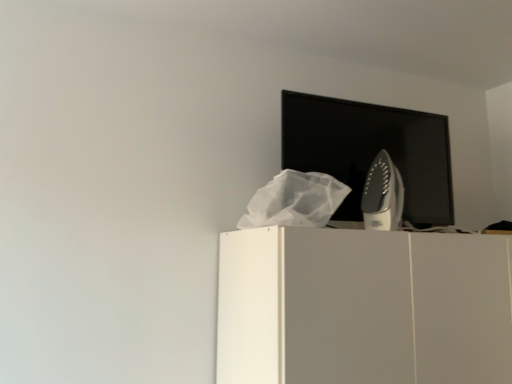
Question: From the image's perspective, is black glossy computer monitor at upper center over white matte cabinet at upper center?

Choices:
 (A) no
 (B) yes

Answer: (B)

Question: Does black glossy computer monitor at upper center have a smaller size compared to white matte cabinet at upper center?

Choices:
 (A) no
 (B) yes

Answer: (B)

Question: From a real-world perspective, is black glossy computer monitor at upper center on top of white matte cabinet at upper center?

Choices:
 (A) no
 (B) yes

Answer: (B)

Question: From the image's perspective, is black glossy computer monitor at upper center below white matte cabinet at upper center?

Choices:
 (A) no
 (B) yes

Answer: (A)

Question: Is black glossy computer monitor at upper center shorter than white matte cabinet at upper center?

Choices:
 (A) yes
 (B) no

Answer: (A)

Question: Is black glossy computer monitor at upper center located outside white matte cabinet at upper center?

Choices:
 (A) yes
 (B) no

Answer: (A)

Question: Is satin silver iron at upper right completely or partially inside white matte cabinet at upper center?

Choices:
 (A) yes
 (B) no

Answer: (B)

Question: Does white matte cabinet at upper center have a smaller size compared to satin silver iron at upper right?

Choices:
 (A) yes
 (B) no

Answer: (B)

Question: Considering the relative sizes of white matte cabinet at upper center and satin silver iron at upper right in the image provided, is white matte cabinet at upper center thinner than satin silver iron at upper right?

Choices:
 (A) no
 (B) yes

Answer: (A)

Question: Is white matte cabinet at upper center further to the viewer compared to satin silver iron at upper right?

Choices:
 (A) yes
 (B) no

Answer: (B)

Question: From a real-world perspective, is white matte cabinet at upper center positioned over satin silver iron at upper right based on gravity?

Choices:
 (A) yes
 (B) no

Answer: (B)

Question: Does white matte cabinet at upper center have a larger size compared to satin silver iron at upper right?

Choices:
 (A) no
 (B) yes

Answer: (B)

Question: Is there a large distance between satin silver iron at upper right and white matte cabinet at upper center?

Choices:
 (A) yes
 (B) no

Answer: (B)